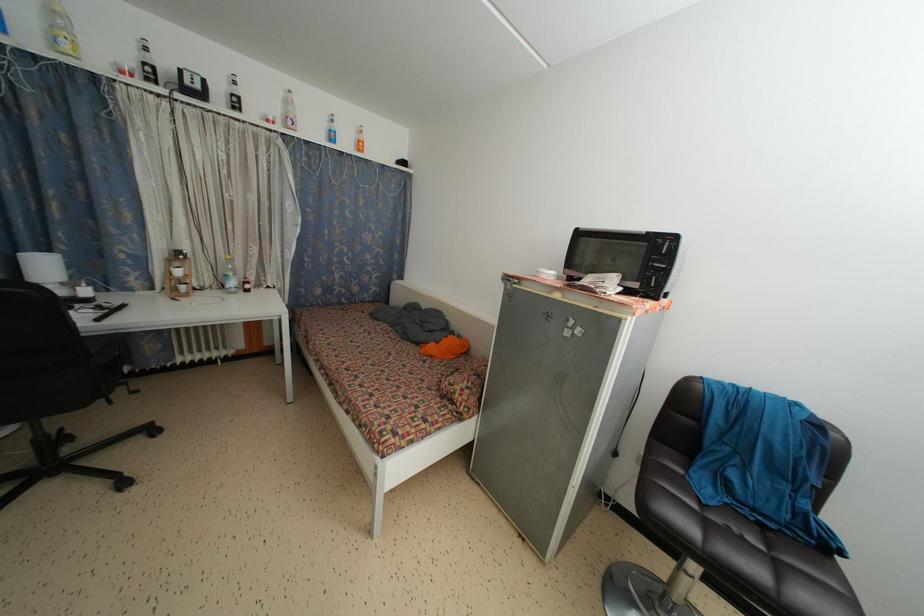
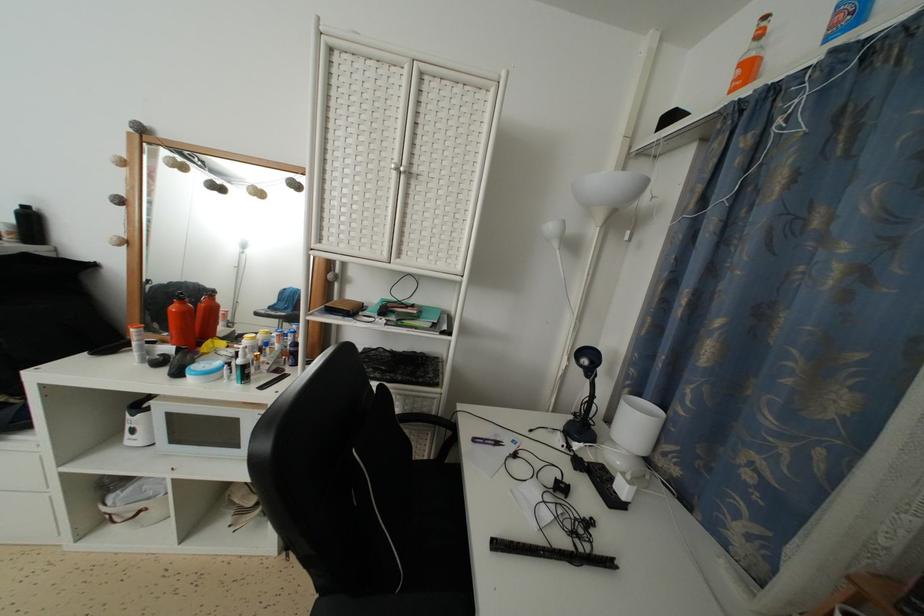
Locate, in the second image, the point that corresponds to point (128, 312) in the first image.

(614, 569)